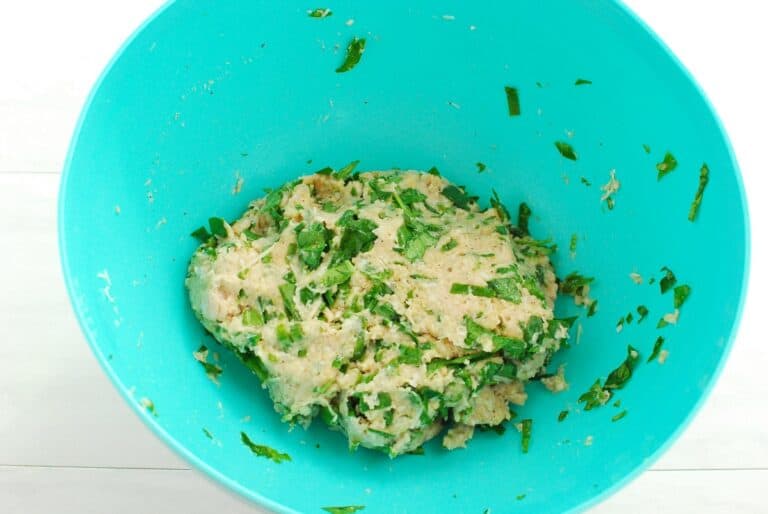
Find the location of `yellow food debris on the bowl`. yellow food debris on the bowl is located at coordinates pos(104,288), pos(154,51), pos(451,14), pos(353,19), pos(571,130), pos(591,442), pos(369,493), pos(219,407).